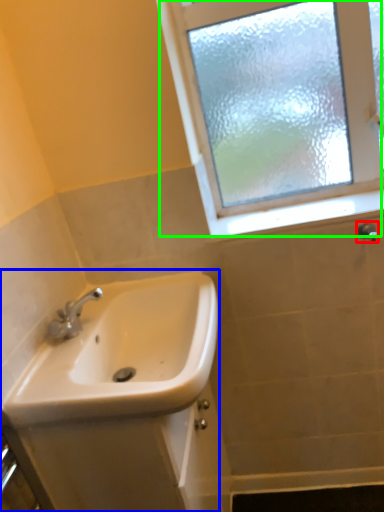
Question: Estimate the real-world distances between objects in this image. Which object is closer to shower (highlighted by a red box), sink (highlighted by a blue box) or window (highlighted by a green box)?

Choices:
 (A) sink
 (B) window

Answer: (B)